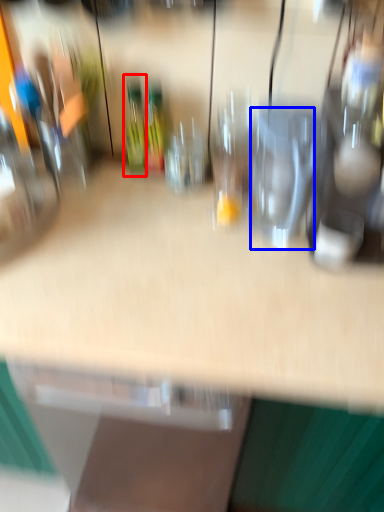
Question: Which of the following is the farthest to the observer, bottle (highlighted by a red box) or wine glass (highlighted by a blue box)?

Choices:
 (A) bottle
 (B) wine glass

Answer: (A)